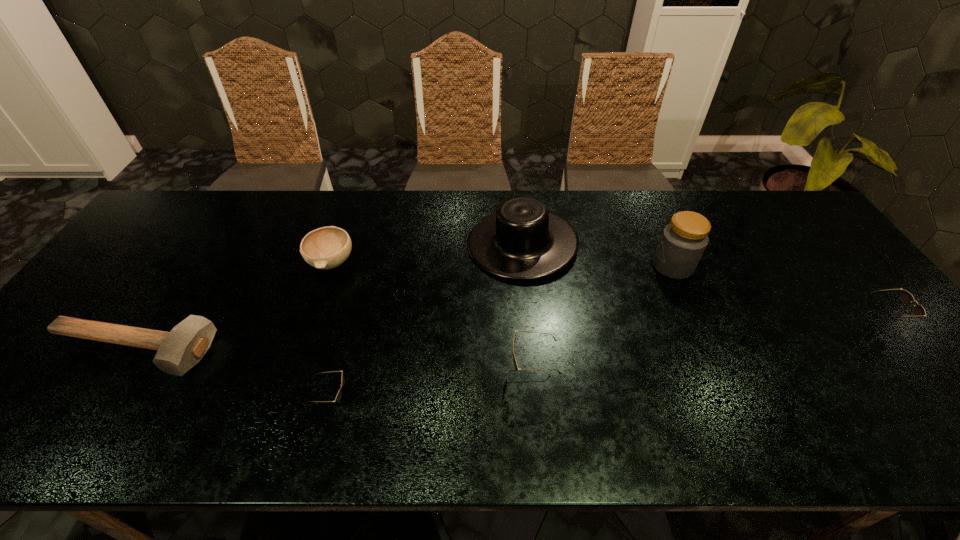
Find the location of a particular element. Image resolution: width=960 pixels, height=540 pixels. free space between the tallest object and the sixth shortest object is located at coordinates (597, 255).

Find the location of a particular element. The image size is (960, 540). free spot between the leftmost object and the second tallest sunglasses is located at coordinates click(505, 336).

This screenshot has height=540, width=960. Identify the location of object that stands as the fourth closest to the sixth object from left to right. (339, 394).

At what (x,y) coordinates should I click in order to perform the action: click on the third closest object to the second tallest object. Please return your answer as a coordinate pair (x, y). Looking at the image, I should click on (328, 247).

Locate an element on the screen. Image resolution: width=960 pixels, height=540 pixels. the second closest sunglasses to the shortest sunglasses is located at coordinates (906, 297).

Identify which sunglasses is the third nearest to the mallet. Please provide its 2D coordinates. Your answer should be formatted as a tuple, i.e. [(x, y)], where the tuple contains the x and y coordinates of a point satisfying the conditions above.

[(906, 297)]

Identify the location of free spot that satisfies the following two spatial constraints: 1. on the front side of the dress hat; 2. in front of the lenses of the leftmost sunglasses. (538, 402).

Where is `vacant region that satisfies the following two spatial constraints: 1. in front of the lenses of the second tallest sunglasses; 2. on the front side of the leftmost object`? This screenshot has height=540, width=960. vacant region that satisfies the following two spatial constraints: 1. in front of the lenses of the second tallest sunglasses; 2. on the front side of the leftmost object is located at coordinates (901, 350).